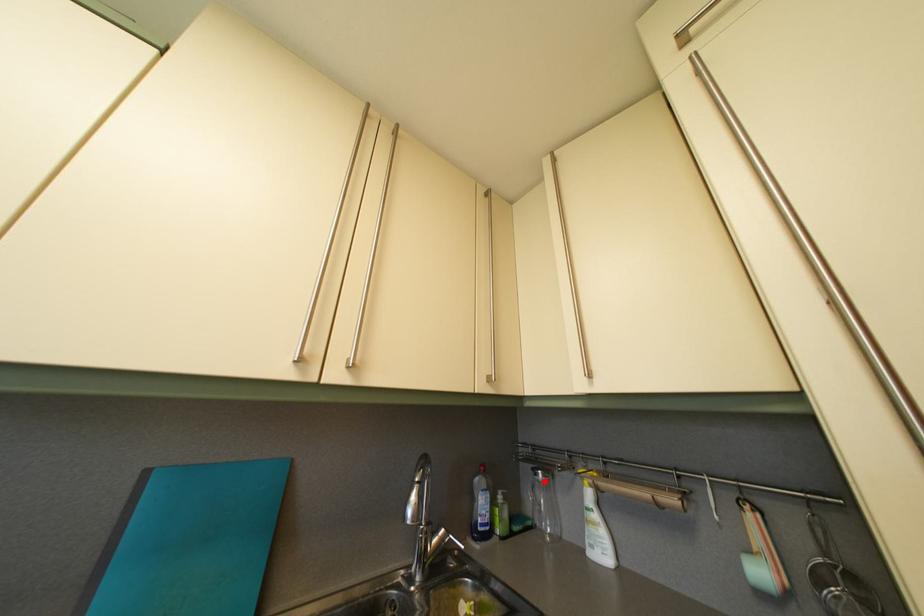
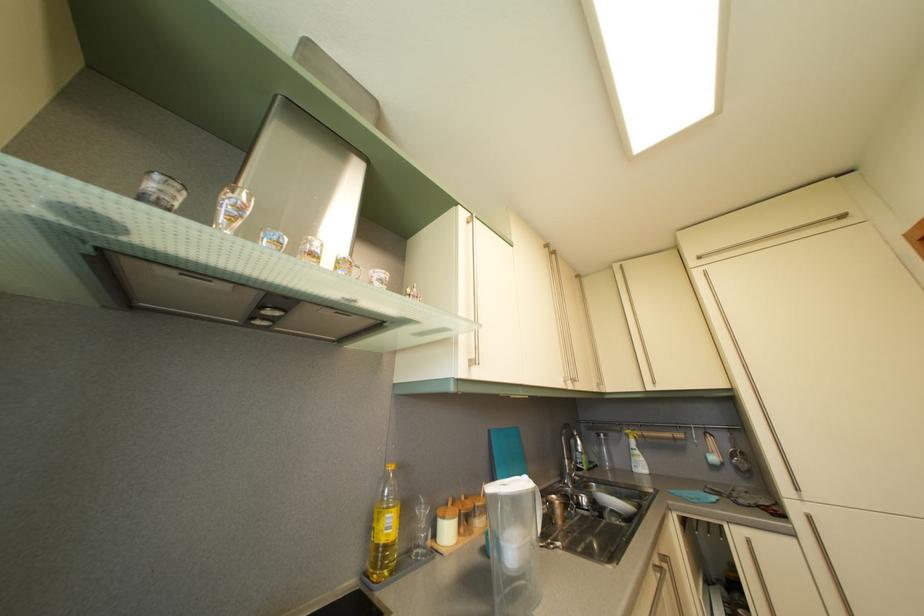
Find the pixel in the second image that matches the highlighted location in the first image.

(608, 444)